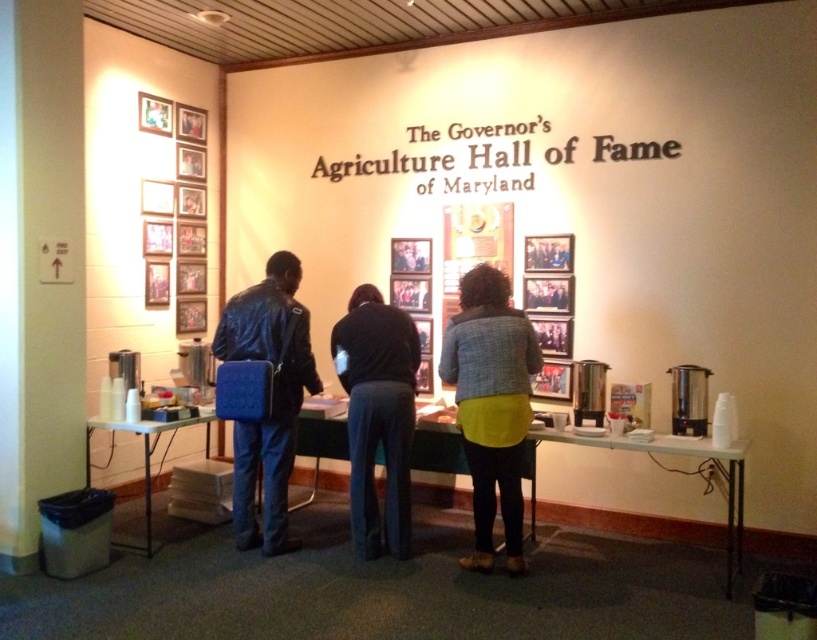
Question: Among these points, which one is farthest from the camera?

Choices:
 (A) (387, 348)
 (B) (490, 524)

Answer: (A)

Question: Is yellow fabric jacket at center above white plastic table at lower left?

Choices:
 (A) no
 (B) yes

Answer: (B)

Question: From the image, what is the correct spatial relationship of blue leather jacket at center in relation to dark blue jeans at center?

Choices:
 (A) right
 (B) left

Answer: (B)

Question: Is dark blue jeans at center thinner than white plastic table at lower center?

Choices:
 (A) yes
 (B) no

Answer: (A)

Question: Estimate the real-world distances between objects in this image. Which object is closer to the blue leather jacket at center?

Choices:
 (A) white plastic table at lower left
 (B) yellow fabric jacket at center

Answer: (A)

Question: Which is nearer to the yellow fabric jacket at center?

Choices:
 (A) white plastic table at lower left
 (B) blue leather jacket at center
 (C) white plastic table at lower center
 (D) dark blue jeans at center

Answer: (D)